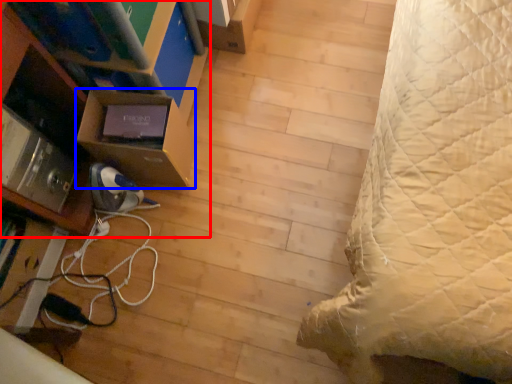
Question: Which object is closer to the camera taking this photo, furniture (highlighted by a red box) or shelf (highlighted by a blue box)?

Choices:
 (A) furniture
 (B) shelf

Answer: (A)